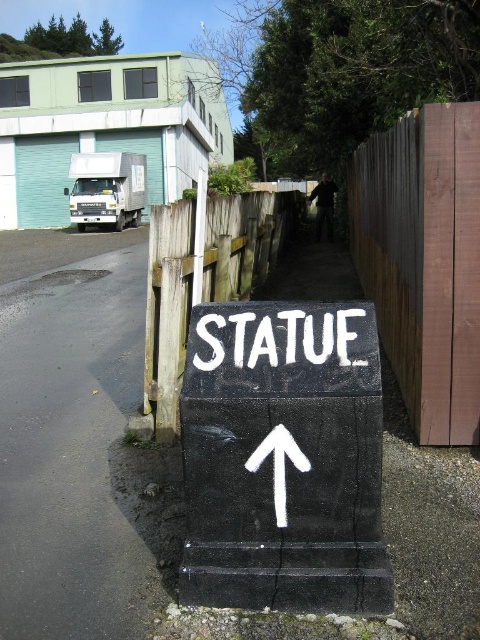
Question: Which object is positioned closest to the black concrete sign at center?

Choices:
 (A) brown wood fence at right
 (B) black asphalt at lower left
 (C) white painted sign at center

Answer: (C)

Question: Which point is farther from the camera taking this photo?

Choices:
 (A) (48, 342)
 (B) (223, 348)

Answer: (A)

Question: Can you confirm if brown wood fence at right is thinner than white matte arrow at center?

Choices:
 (A) yes
 (B) no

Answer: (A)

Question: Which point is farther to the camera?

Choices:
 (A) (45, 404)
 (B) (336, 589)
 (C) (312, 348)
 (D) (168, 234)

Answer: (A)

Question: Can you confirm if brown wood fence at right is positioned above wooden fence at center?

Choices:
 (A) yes
 (B) no

Answer: (B)

Question: Does black concrete sign at center appear over white painted sign at center?

Choices:
 (A) yes
 (B) no

Answer: (B)